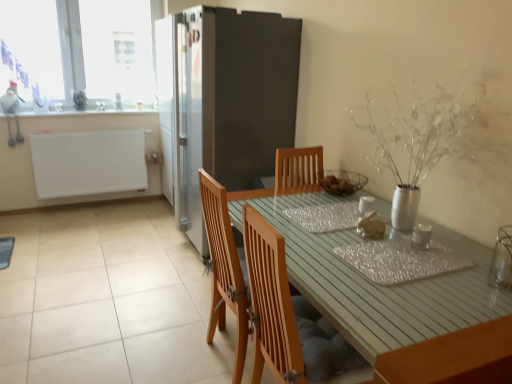
Image resolution: width=512 pixels, height=384 pixels. What are the coordinates of `free location in front of shiny metallic placemat at center` in the screenshot? It's located at (435, 307).